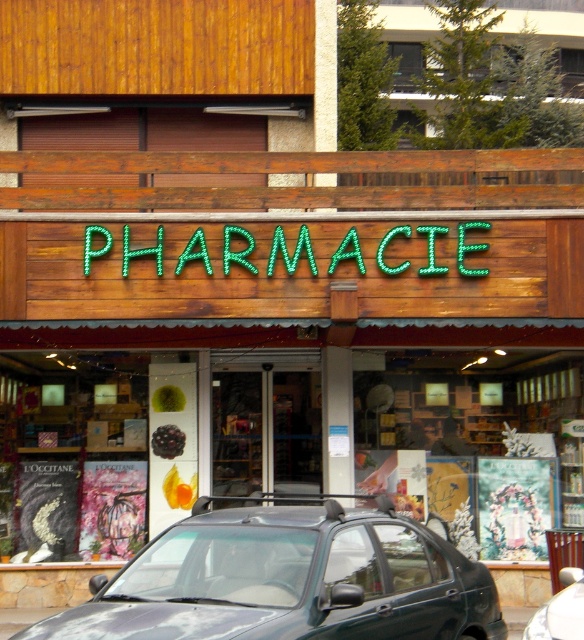
Question: Estimate the real-world distances between objects in this image. Which object is closer to the green neon sign at center?

Choices:
 (A) wooden display case at center
 (B) metallic gray car at center
 (C) dark green matte car at center

Answer: (A)

Question: Observing the image, what is the correct spatial positioning of wooden display case at center in reference to dark green matte car at center?

Choices:
 (A) above
 (B) below

Answer: (A)

Question: Which object appears closest to the camera in this image?

Choices:
 (A) dark green matte car at center
 (B) wooden display case at center

Answer: (A)

Question: Based on their relative distances, which object is farther from the green neon sign at center?

Choices:
 (A) dark green matte car at center
 (B) metallic gray car at center

Answer: (B)

Question: In this image, where is wooden display case at center located relative to green neon sign at center?

Choices:
 (A) above
 (B) below

Answer: (B)

Question: Does dark green matte car at center have a lesser width compared to green neon sign at center?

Choices:
 (A) yes
 (B) no

Answer: (A)